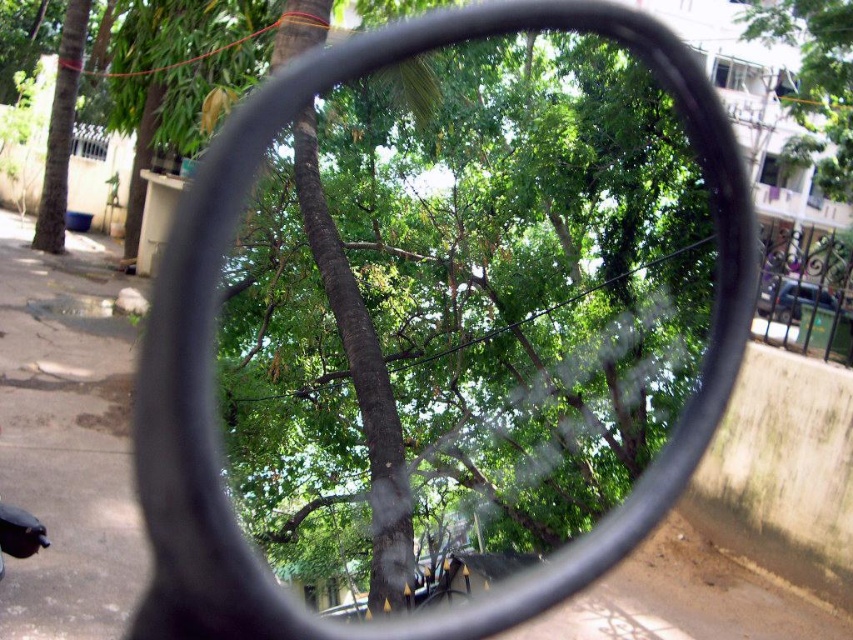
Does green leafy tree at upper right appear on the right side of green leafy tree at left?

Yes, green leafy tree at upper right is to the right of green leafy tree at left.

Is green leafy tree at upper right thinner than green leafy tree at left?

No, green leafy tree at upper right is not thinner than green leafy tree at left.

Is point (804, 26) farther from camera compared to point (68, 1)?

That is False.

You are a GUI agent. You are given a task and a screenshot of the screen. Output one action in this format:
    pyautogui.click(x=<x>, y=<y>)
    Task: Click on the green leafy tree at upper right
    Image resolution: width=853 pixels, height=640 pixels.
    Given the screenshot: What is the action you would take?
    pyautogui.click(x=814, y=81)

Is point (204, 396) less distant than point (86, 1)?

Yes.

Can you confirm if black rubber mirror at center is smaller than green leafy tree at left?

No.

You are a GUI agent. You are given a task and a screenshot of the screen. Output one action in this format:
    pyautogui.click(x=<x>, y=<y>)
    Task: Click on the black rubber mirror at center
    
    Given the screenshot: What is the action you would take?
    pyautogui.click(x=213, y=333)

Where is `black rubber mirror at center`? black rubber mirror at center is located at coordinates tap(213, 333).

Is black rubber mirror at center smaller than green leafy tree at upper right?

No, black rubber mirror at center is not smaller than green leafy tree at upper right.

Can you confirm if black rubber mirror at center is shorter than green leafy tree at upper right?

No.

The height and width of the screenshot is (640, 853). In order to click on black rubber mirror at center in this screenshot , I will do `click(213, 333)`.

At what (x,y) coordinates should I click in order to perform the action: click on black rubber mirror at center. Please return your answer as a coordinate pair (x, y). Image resolution: width=853 pixels, height=640 pixels. Looking at the image, I should click on (213, 333).